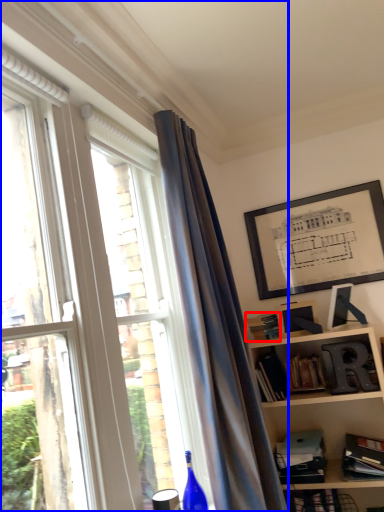
Question: Which object appears farthest to the camera in this image, paperback book (highlighted by a red box) or window (highlighted by a blue box)?

Choices:
 (A) paperback book
 (B) window

Answer: (A)